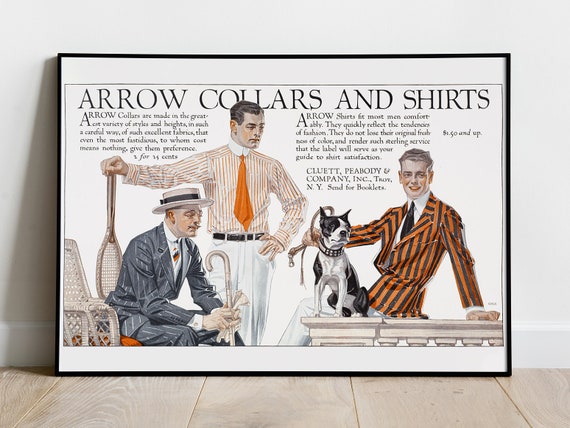
Where is `frame`? The image size is (570, 428). frame is located at coordinates (305, 373).